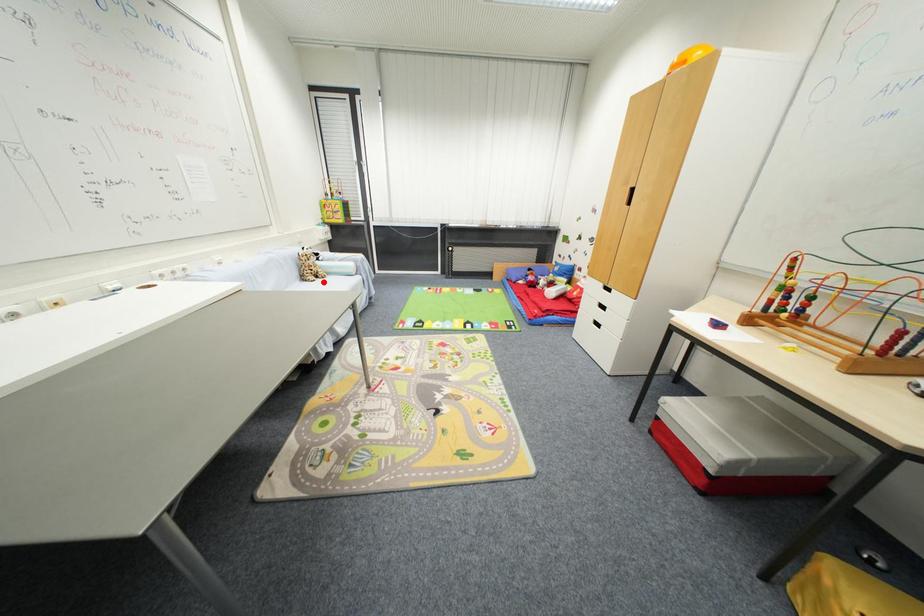
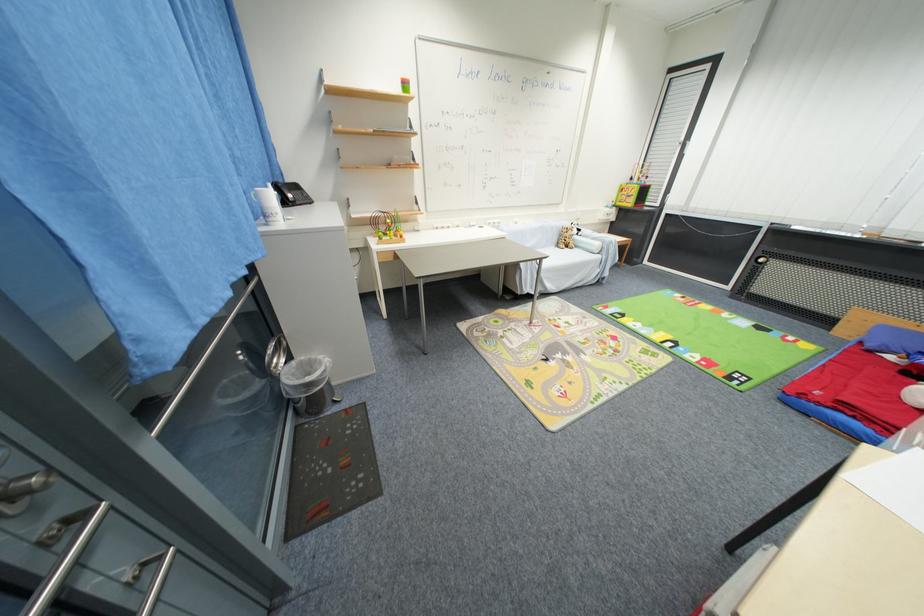
In the second image, find the point that corresponds to the highlighted location in the first image.

(572, 251)